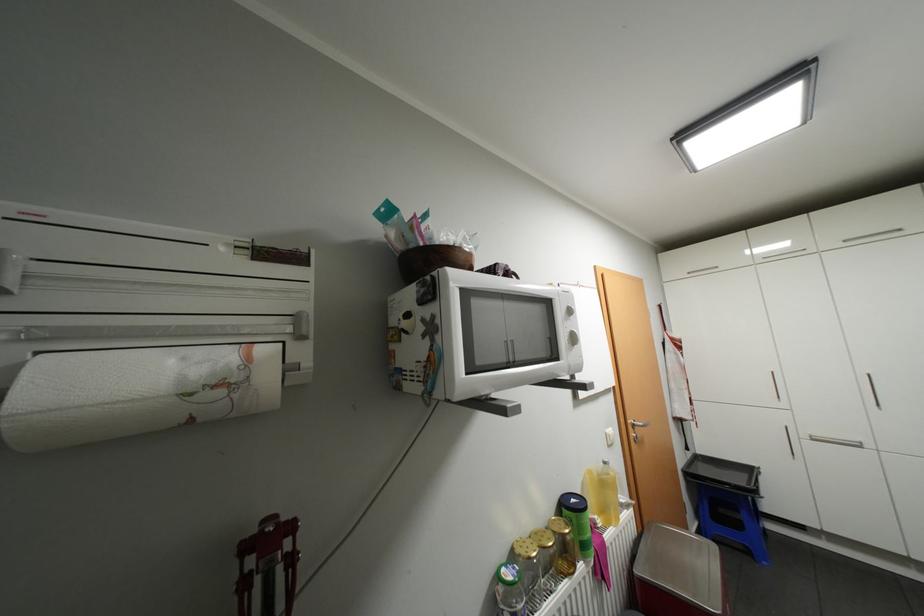
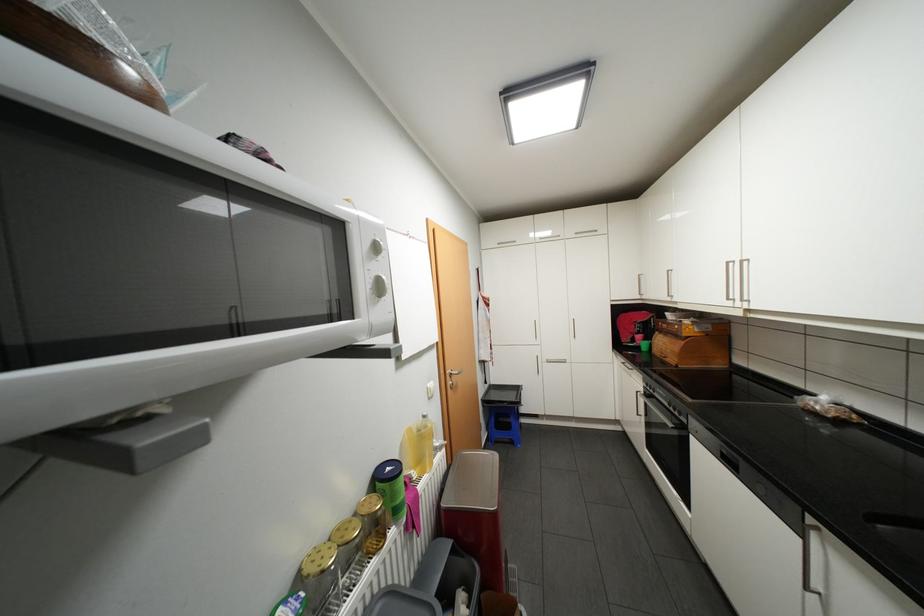
Question: The camera is either moving clockwise (left) or counter-clockwise (right) around the object. The first image is from the beginning of the video and the second image is from the end. Is the camera moving left or right when shooting the video?

Choices:
 (A) Left
 (B) Right

Answer: (A)